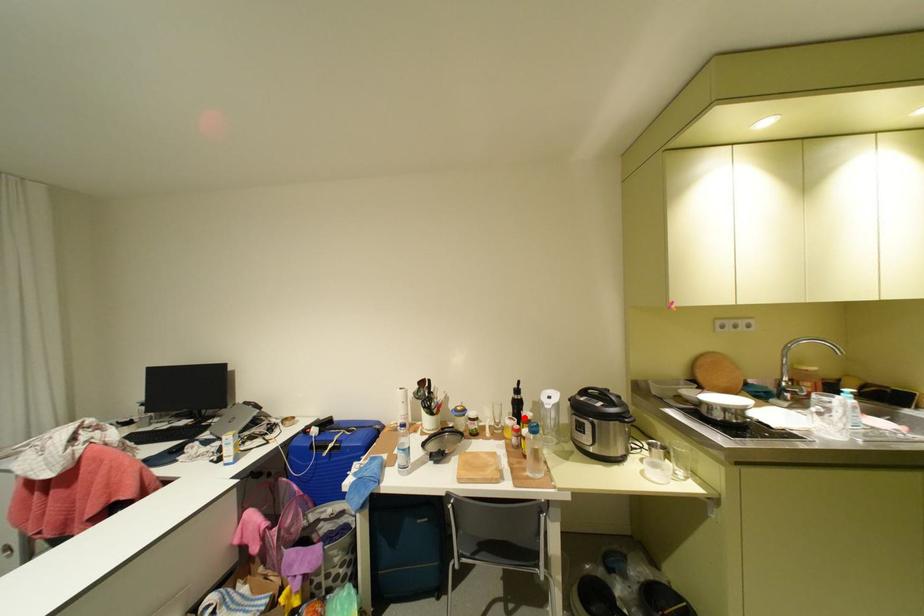
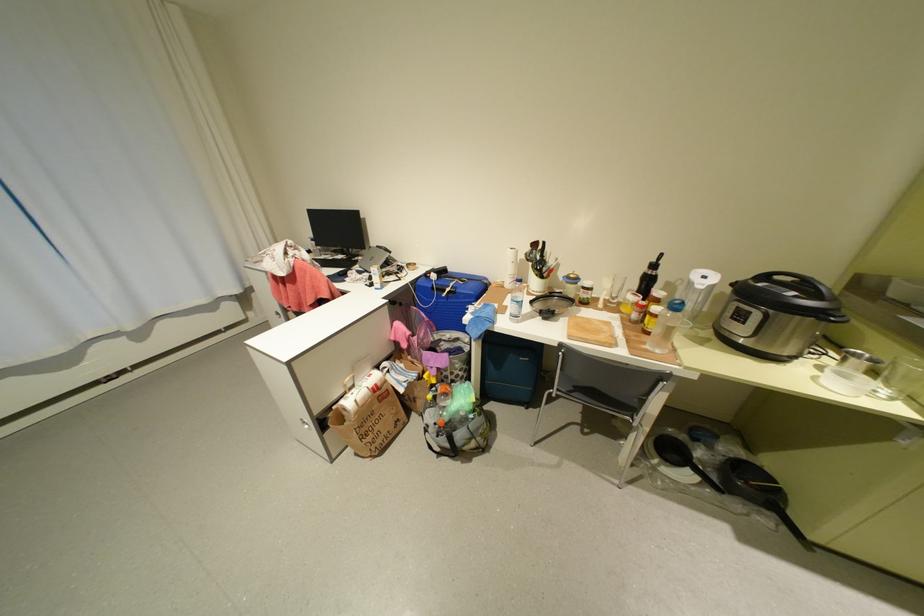
Question: I am providing you with two images of the same scene from different viewpoints. Image1 has a red point marked. In image2, the corresponding 3D location appears at what relative position? Reply with the corresponding letter.

Choices:
 (A) Closer
 (B) Farther

Answer: (A)